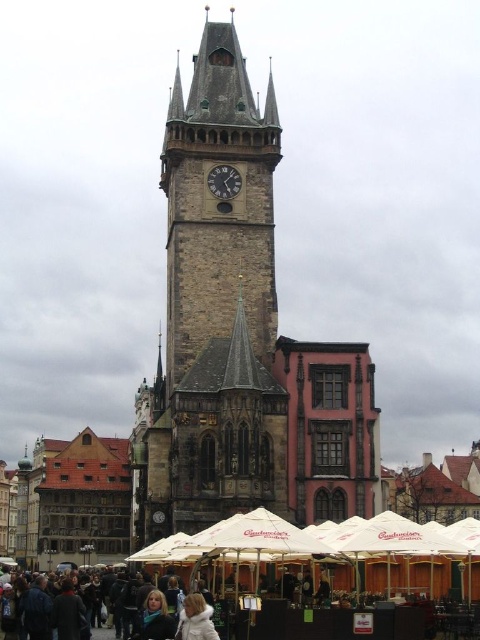
Between stone clock tower at center and white fuzzy coat at center, which one is positioned higher?

stone clock tower at center

Locate an element on the screen. stone clock tower at center is located at coordinates (218, 204).

I want to click on stone clock tower at center, so click(218, 204).

Can you confirm if white fuzzy coat at center is positioned to the left of dark gray stone clock at center?

In fact, white fuzzy coat at center is to the right of dark gray stone clock at center.

Where is `white fuzzy coat at center`? Image resolution: width=480 pixels, height=640 pixels. white fuzzy coat at center is located at coordinates (195, 620).

What are the coordinates of `white fuzzy coat at center` in the screenshot? It's located at (195, 620).

Find the location of a particular element. stone clock tower at center is located at coordinates (218, 204).

Is point (200, 321) more distant than point (223, 189)?

No.

Image resolution: width=480 pixels, height=640 pixels. Identify the location of stone clock tower at center. (218, 204).